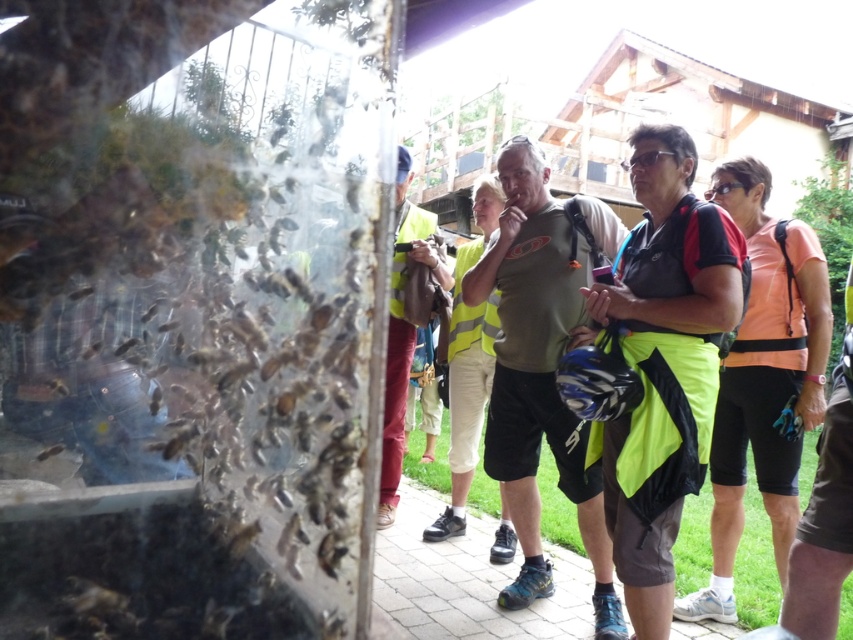
Is matte green t-shirt at center shorter than black plastic goggles at center?

No.

Is matte green t-shirt at center wider than black plastic goggles at center?

Yes.

What do you see at coordinates (541, 369) in the screenshot? The height and width of the screenshot is (640, 853). I see `matte green t-shirt at center` at bounding box center [541, 369].

Locate an element on the screen. matte green t-shirt at center is located at coordinates (541, 369).

Is black matte shorts at center positioned in front of matte green t-shirt at center?

Yes, it is in front of matte green t-shirt at center.

Based on the photo, is black matte shorts at center further to camera compared to matte green t-shirt at center?

No, black matte shorts at center is in front of matte green t-shirt at center.

At what (x,y) coordinates should I click in order to perform the action: click on black matte shorts at center. Please return your answer as a coordinate pair (x, y). Image resolution: width=853 pixels, height=640 pixels. Looking at the image, I should click on (664, 364).

This screenshot has width=853, height=640. I want to click on black matte shorts at center, so click(x=664, y=364).

Is point (402, 208) farther from camera compared to point (708, 198)?

Yes, it is.

What do you see at coordinates (402, 330) in the screenshot? I see `yellow reflective vest at center` at bounding box center [402, 330].

You are a GUI agent. You are given a task and a screenshot of the screen. Output one action in this format:
    pyautogui.click(x=<x>, y=<y>)
    Task: Click on the yellow reflective vest at center
    The height and width of the screenshot is (640, 853).
    Given the screenshot: What is the action you would take?
    pyautogui.click(x=402, y=330)